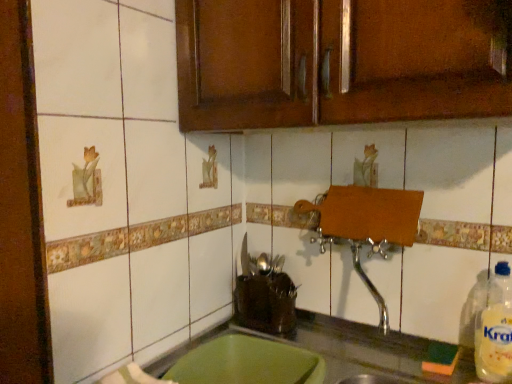
This screenshot has width=512, height=384. What do you see at coordinates (495, 329) in the screenshot?
I see `clear plastic bottle at right` at bounding box center [495, 329].

Locate an element on the screen. The width and height of the screenshot is (512, 384). green plastic tray at lower center is located at coordinates (343, 348).

What do you see at coordinates (341, 62) in the screenshot? I see `brown wood cabinet at upper center` at bounding box center [341, 62].

Find the location of a particular element. This screenshot has width=512, height=384. clear plastic bottle at right is located at coordinates (495, 329).

Considering the relative positions of green plastic tray at lower center and clear plastic bottle at right in the image provided, is green plastic tray at lower center in front of clear plastic bottle at right?

Yes, the depth of green plastic tray at lower center is less than that of clear plastic bottle at right.

Do you think green plastic tray at lower center is within clear plastic bottle at right, or outside of it?

green plastic tray at lower center is located beyond the bounds of clear plastic bottle at right.

Does green plastic tray at lower center turn towards clear plastic bottle at right?

No, green plastic tray at lower center is not turned towards clear plastic bottle at right.

From a real-world perspective, which is physically below, brown wood cabinet at upper center or clear plastic bottle at right?

clear plastic bottle at right.

In terms of size, does brown wood cabinet at upper center appear bigger or smaller than clear plastic bottle at right?

Clearly, brown wood cabinet at upper center is larger in size than clear plastic bottle at right.

Would you say brown wood cabinet at upper center is a long distance from clear plastic bottle at right?

brown wood cabinet at upper center is near clear plastic bottle at right, not far away.

Is clear plastic bottle at right next to green plastic tray at lower center?

No, clear plastic bottle at right is not next to green plastic tray at lower center.

Is point (506, 343) positioned before point (190, 349)?

Yes, it is in front of point (190, 349).

From the image's perspective, which one is positioned higher, clear plastic bottle at right or green plastic tray at lower center?

From the image's view, clear plastic bottle at right is above.

Based on the photo, which object is closer to the camera taking this photo, clear plastic bottle at right or green plastic tray at lower center?

green plastic tray at lower center is more forward.

Is brown wood cabinet at upper center outside of green plastic tray at lower center?

Yes, brown wood cabinet at upper center is not within green plastic tray at lower center.

Is brown wood cabinet at upper center in contact with green plastic tray at lower center?

No, brown wood cabinet at upper center is not beside green plastic tray at lower center.

Can you tell me how much brown wood cabinet at upper center and green plastic tray at lower center differ in facing direction?

The angle between the facing direction of brown wood cabinet at upper center and the facing direction of green plastic tray at lower center is 0.000492 degrees.

From the image's perspective, is brown wood cabinet at upper center above or below green plastic tray at lower center?

brown wood cabinet at upper center is situated higher than green plastic tray at lower center in the image.

Which is in front, point (503, 288) or point (494, 23)?

Point (494, 23)

Consider the image. From a real-world perspective, is clear plastic bottle at right on brown wood cabinet at upper center?

No, from a real-world perspective, clear plastic bottle at right is not on top of brown wood cabinet at upper center.

This screenshot has height=384, width=512. I want to click on cabinetry lying in front of the clear plastic bottle at right, so click(341, 62).

Consider the image. How different are the orientations of clear plastic bottle at right and brown wood cabinet at upper center in degrees?

The facing directions of clear plastic bottle at right and brown wood cabinet at upper center are 0.68 degrees apart.

In the image, is green plastic tray at lower center positioned in front of or behind brown wood cabinet at upper center?

green plastic tray at lower center is in front of brown wood cabinet at upper center.

Which of these two, green plastic tray at lower center or brown wood cabinet at upper center, stands taller?

Standing taller between the two is brown wood cabinet at upper center.

Is green plastic tray at lower center situated inside brown wood cabinet at upper center or outside?

The correct answer is: outside.

Locate an element on the screen. This screenshot has width=512, height=384. countertop on the left of clear plastic bottle at right is located at coordinates (343, 348).

Where is `bottle on the right side of brown wood cabinet at upper center`? This screenshot has height=384, width=512. bottle on the right side of brown wood cabinet at upper center is located at coordinates (495, 329).

Based on their spatial positions, is green plastic tray at lower center or brown wood cabinet at upper center further from clear plastic bottle at right?

Among the two, brown wood cabinet at upper center is located further to clear plastic bottle at right.

Which object lies further to the anchor point brown wood cabinet at upper center, clear plastic bottle at right or green plastic tray at lower center?

Among the two, green plastic tray at lower center is located further to brown wood cabinet at upper center.

When comparing their distances from green plastic tray at lower center, does clear plastic bottle at right or brown wood cabinet at upper center seem closer?

The object closer to green plastic tray at lower center is clear plastic bottle at right.

Estimate the real-world distances between objects in this image. Which object is closer to green plastic tray at lower center, brown wood cabinet at upper center or clear plastic bottle at right?

Among the two, clear plastic bottle at right is located nearer to green plastic tray at lower center.

When comparing their distances from clear plastic bottle at right, does brown wood cabinet at upper center or green plastic tray at lower center seem closer?

green plastic tray at lower center lies closer to clear plastic bottle at right than the other object.

From the image, which object appears to be farther from brown wood cabinet at upper center, green plastic tray at lower center or clear plastic bottle at right?

green plastic tray at lower center.

Find the location of a particular element. This screenshot has height=384, width=512. bottle between brown wood cabinet at upper center and green plastic tray at lower center from top to bottom is located at coordinates (495, 329).